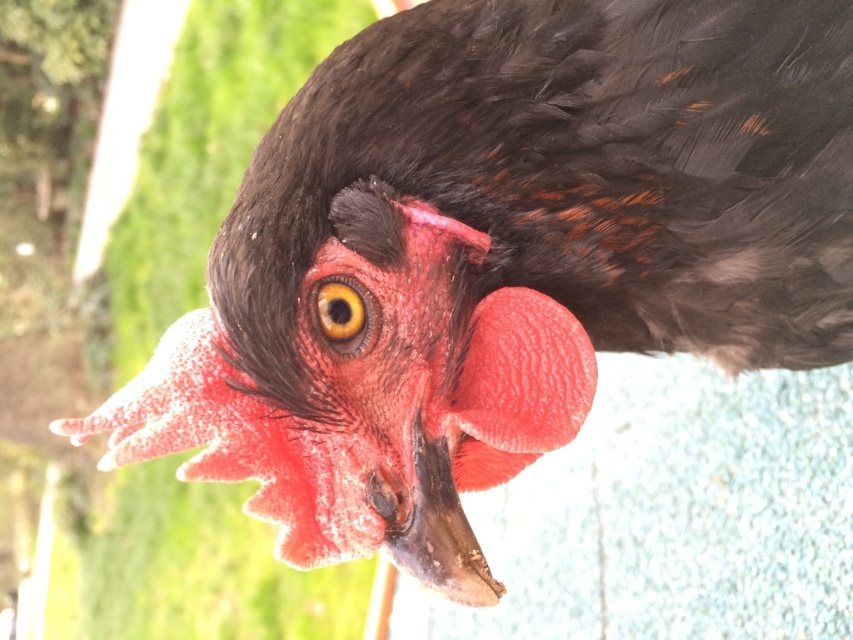
You are a farmer checking the health of a chicken. You notice the slick black beak at center and yellow shiny eye at center. How far apart are these two features on the chicken?

The slick black beak at center and yellow shiny eye at center are 4.36 inches apart from each other.

You are a photographer trying to capture the chicken in the image. The chicken is facing directly towards you. You want to ensure that the slick black beak at center is in focus. Given that your camera can only focus on a single point, which is currently set at point [439,531], will the slick black beak at center be in focus?

Yes, the slick black beak at center is exactly at point [439,531], so the camera will focus on it.

You are a farmer inspecting a chicken. You notice the slick black beak at center and the yellow shiny eye at center. Which of these two features is bigger?

The slick black beak at center is larger in size than the yellow shiny eye at center.